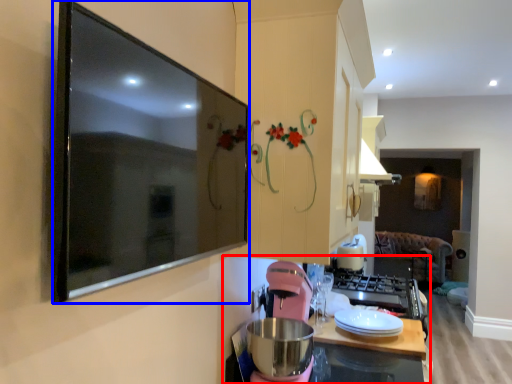
Question: Among these objects, which one is farthest to the camera, countertop (highlighted by a red box) or picture frame (highlighted by a blue box)?

Choices:
 (A) countertop
 (B) picture frame

Answer: (A)